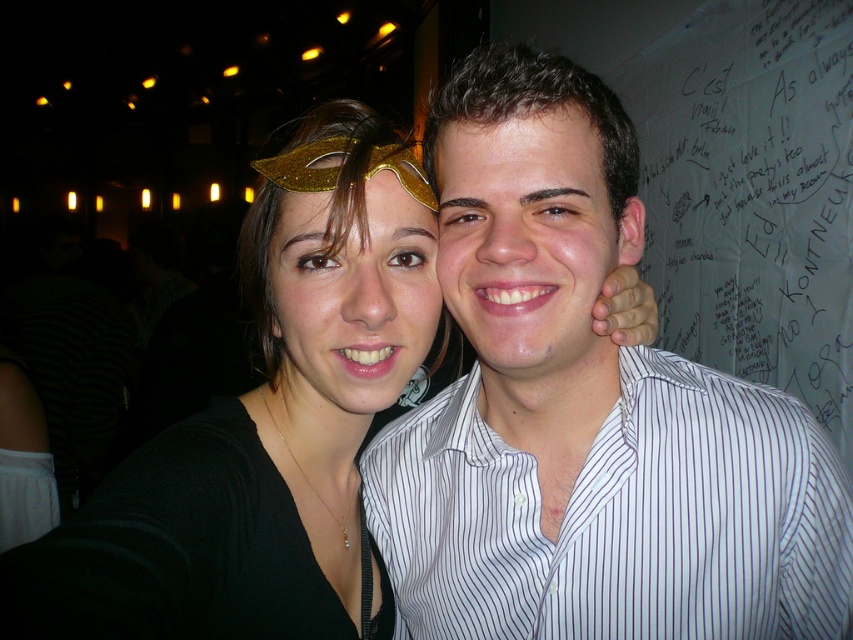
You are at a party and want to take a photo with both the white striped shirt at upper right and the white striped shirt at right in the frame. Which one should you position closer to the center to ensure both are visible?

To ensure both the white striped shirt at upper right and the white striped shirt at right are visible in the frame, position the white striped shirt at upper right closer to the center since it is already to the left of the white striped shirt at right.

You are a photographer at the event and want to ensure both the white paper at upper right and the smooth white shirt at center are visible in your photo. Which object should you focus on to ensure the taller one is properly framed?

The white paper at upper right is taller than the smooth white shirt at center, so focusing on the white paper at upper right will ensure the taller object is properly framed.

You are at a party and want to take a selfie with both the matte black mask at upper left and the white paper at upper right in the frame. Based on their positions, which object should you position closer to the bottom of your camera view?

The matte black mask at upper left should be positioned closer to the bottom of your camera view because it is located below the white paper at upper right.